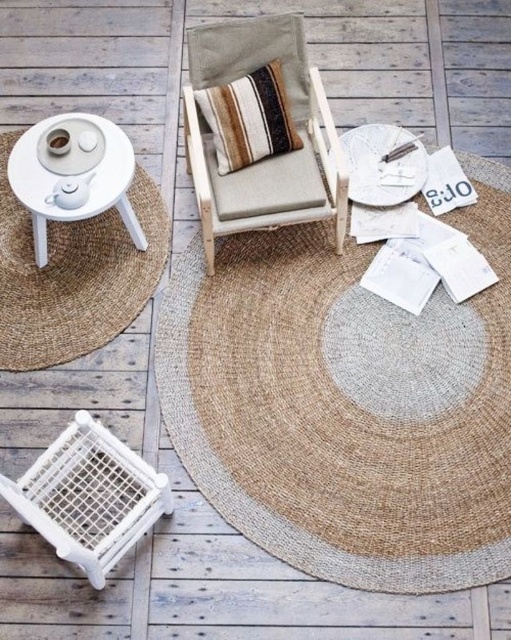
Between natural jute mat at center and natural jute mat at left, which one is positioned lower?

natural jute mat at center

Does natural jute mat at center lie behind natural jute mat at left?

No, natural jute mat at center is in front of natural jute mat at left.

Which is behind, point (481, 444) or point (88, 294)?

The point (88, 294) is more distant.

The height and width of the screenshot is (640, 511). Find the location of `natural jute mat at center`. natural jute mat at center is located at coordinates (346, 403).

Who is taller, beige fabric armchair at center or white matte table at upper left?

beige fabric armchair at center

Identify the location of beige fabric armchair at center. The height and width of the screenshot is (640, 511). (267, 157).

Which is in front, point (235, 52) or point (96, 193)?

Point (96, 193)

Image resolution: width=511 pixels, height=640 pixels. Identify the location of beige fabric armchair at center. (267, 157).

Can you confirm if beige fabric armchair at center is thinner than striped fabric pillow at center?

No.

Can you confirm if beige fabric armchair at center is positioned to the left of striped fabric pillow at center?

Incorrect, beige fabric armchair at center is not on the left side of striped fabric pillow at center.

Looking at this image, who is more forward, (x=214, y=168) or (x=254, y=83)?

Point (x=254, y=83) is in front.

Locate an element on the screen. beige fabric armchair at center is located at coordinates coord(267,157).